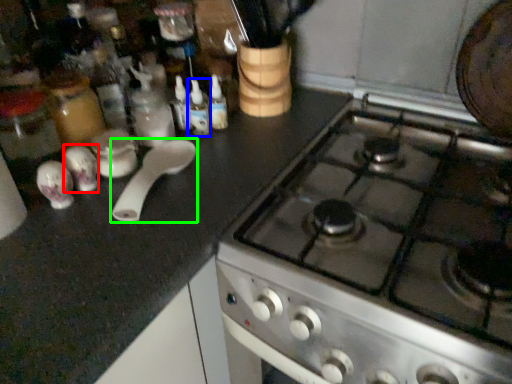
Question: Estimate the real-world distances between objects in this image. Which object is closer to tableware (highlighted by a red box), bottle (highlighted by a blue box) or kitchen appliance (highlighted by a green box)?

Choices:
 (A) bottle
 (B) kitchen appliance

Answer: (B)